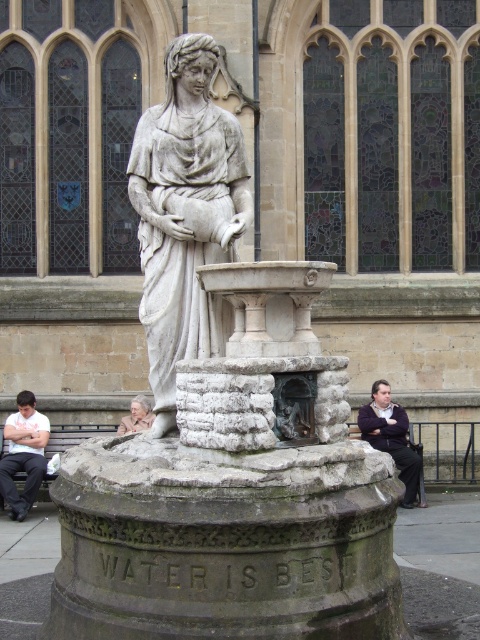
Who is shorter, dark brown leather jacket at lower right or light beige stone statue at center?

With less height is light beige stone statue at center.

Image resolution: width=480 pixels, height=640 pixels. Identify the location of dark brown leather jacket at lower right. (391, 436).

Identify the location of dark brown leather jacket at lower right. The height and width of the screenshot is (640, 480). (391, 436).

Measure the distance between white stone statue at center and dark brown leather jacket at lower right.

white stone statue at center is 12.30 meters from dark brown leather jacket at lower right.

You are a GUI agent. You are given a task and a screenshot of the screen. Output one action in this format:
    pyautogui.click(x=<x>, y=<y>)
    Task: Click on the white stone statue at center
    
    Given the screenshot: What is the action you would take?
    pyautogui.click(x=186, y=216)

Which is below, white stone statue at center or white cotton shirt at lower left?

Positioned lower is white cotton shirt at lower left.

Which is behind, point (149, 356) or point (9, 502)?

Point (9, 502)

Is point (179, 252) in front of point (7, 472)?

Yes, point (179, 252) is in front of point (7, 472).

Where is `white stone statue at center`? This screenshot has height=640, width=480. white stone statue at center is located at coordinates (186, 216).